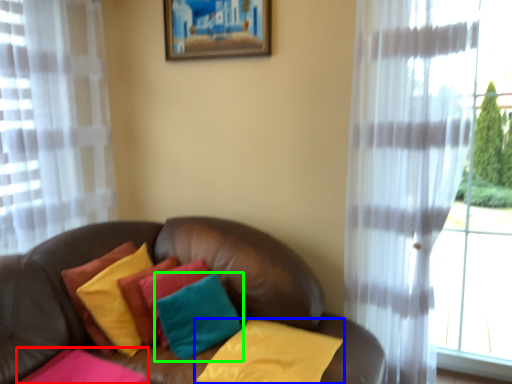
Question: Based on their relative distances, which object is farther from pillow (highlighted by a red box)? Choose from pillow (highlighted by a blue box) and pillow (highlighted by a green box).

Choices:
 (A) pillow
 (B) pillow

Answer: (A)